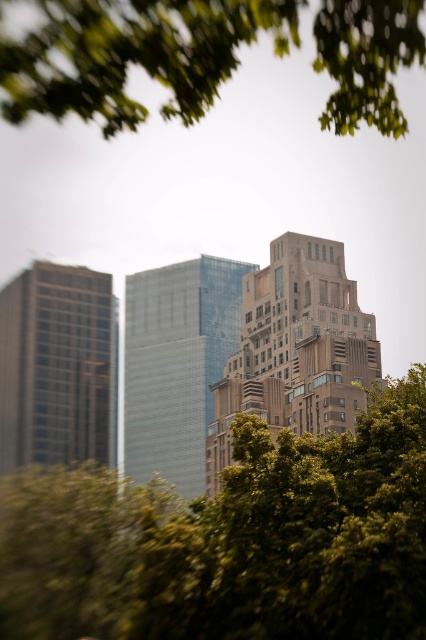
Question: Can you confirm if green leafy tree at upper center is smaller than glassy reflective skyscraper at left?

Choices:
 (A) no
 (B) yes

Answer: (B)

Question: Which object is the farthest from the glassy reflective skyscraper at center?

Choices:
 (A) green leafy tree at upper center
 (B) green leafy tree at center
 (C) brown stone building at center

Answer: (A)

Question: Which object is positioned closest to the glassy reflective skyscraper at left?

Choices:
 (A) green leafy tree at center
 (B) brown stone building at center

Answer: (B)

Question: Is green leafy tree at upper center behind brown stone building at center?

Choices:
 (A) no
 (B) yes

Answer: (A)

Question: Considering the relative positions of green leafy tree at center and glassy reflective skyscraper at center in the image provided, where is green leafy tree at center located with respect to glassy reflective skyscraper at center?

Choices:
 (A) below
 (B) above

Answer: (B)

Question: Which point is farther to the camera?

Choices:
 (A) green leafy tree at upper center
 (B) green leafy tree at center
 (C) glassy reflective skyscraper at center

Answer: (C)